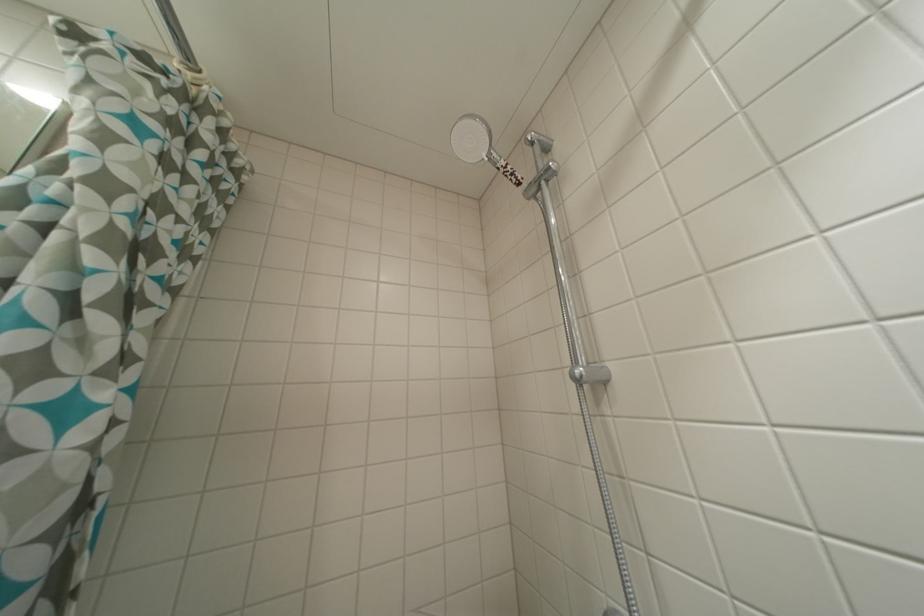
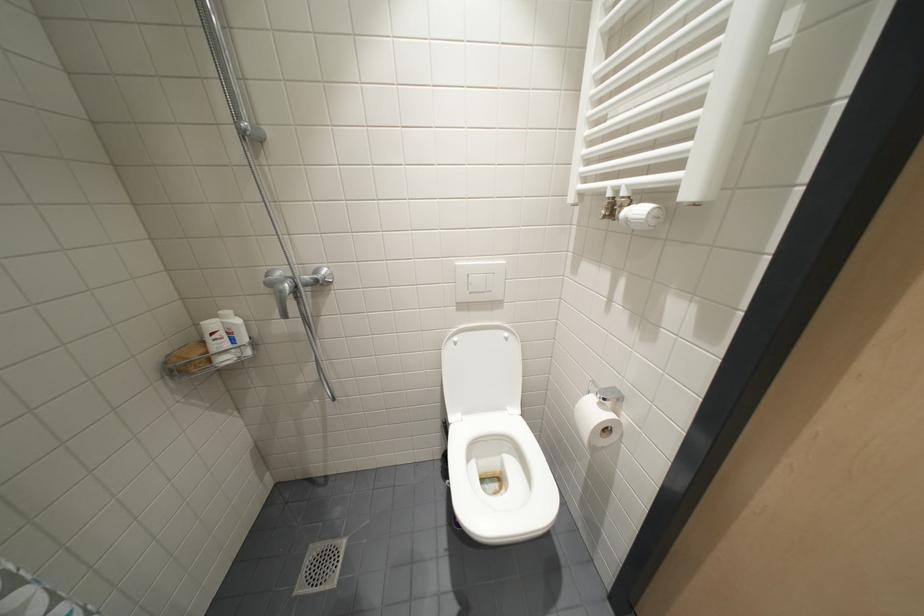
How did the camera likely rotate?

The camera rotated toward right-down.